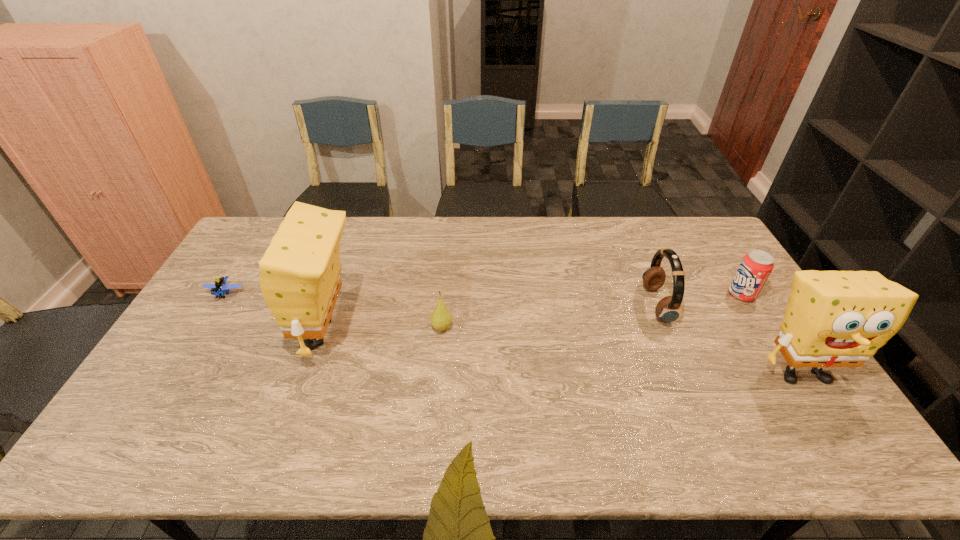
Where is `free space located on the surface of the fourth tallest object`? The height and width of the screenshot is (540, 960). free space located on the surface of the fourth tallest object is located at coordinates (635, 294).

You are a GUI agent. You are given a task and a screenshot of the screen. Output one action in this format:
    pyautogui.click(x=<x>, y=<y>)
    Task: Click on the vacant space located on the front-facing side of the leftmost object
    The image size is (960, 540).
    Given the screenshot: What is the action you would take?
    pyautogui.click(x=153, y=414)

I want to click on vacant space situated on the back of the fifth tallest object, so click(445, 280).

In order to click on object located in the near edge section of the desktop in this screenshot , I will do [833, 318].

You are a GUI agent. You are given a task and a screenshot of the screen. Output one action in this format:
    pyautogui.click(x=<x>, y=<y>)
    Task: Click on the object that is at the left edge
    
    Given the screenshot: What is the action you would take?
    pyautogui.click(x=220, y=286)

In order to click on sponge present at the right edge in this screenshot , I will do `click(833, 318)`.

Locate an element on the screen. The height and width of the screenshot is (540, 960). soda can that is at the right edge is located at coordinates (756, 266).

Where is `object at the near right corner`? object at the near right corner is located at coordinates (833, 318).

Where is `vacant region at the far edge of the desktop`? vacant region at the far edge of the desktop is located at coordinates (618, 216).

Identify the location of vacant space at the left edge of the desktop. Image resolution: width=960 pixels, height=540 pixels. (222, 344).